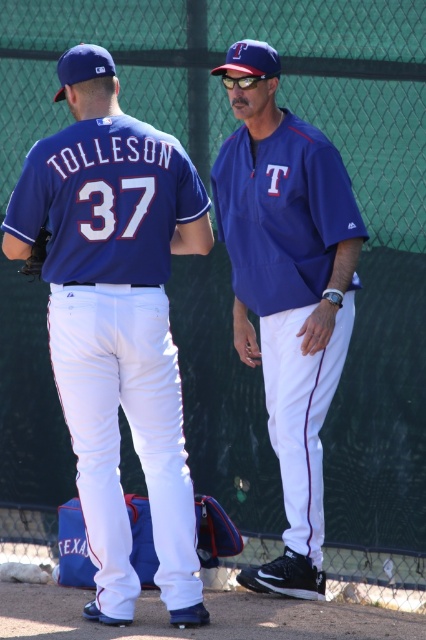
Who is positioned more to the left, matte blue jersey at center or matte blue uniform at center?

From the viewer's perspective, matte blue jersey at center appears more on the left side.

Is matte blue jersey at center behind matte blue uniform at center?

No, matte blue jersey at center is in front of matte blue uniform at center.

Which is behind, point (138, 161) or point (230, 248)?

The point (230, 248) is more distant.

What are the coordinates of `matte blue jersey at center` in the screenshot? It's located at (117, 321).

Between point (69, 289) and point (39, 269), which one is positioned behind?

The point (39, 269) is more distant.

Which is in front, point (54, 220) or point (23, 266)?

Positioned in front is point (54, 220).

This screenshot has height=640, width=426. In order to click on matte blue jersey at center in this screenshot , I will do `click(117, 321)`.

Can you confirm if matte blue uniform at center is positioned above brown leather glove at lower left?

No, matte blue uniform at center is not above brown leather glove at lower left.

Between matte blue uniform at center and brown leather glove at lower left, which one is positioned lower?

matte blue uniform at center is lower down.

Does point (310, 156) lie behind point (37, 243)?

Yes, it is.

Locate an element on the screen. matte blue uniform at center is located at coordinates (287, 291).